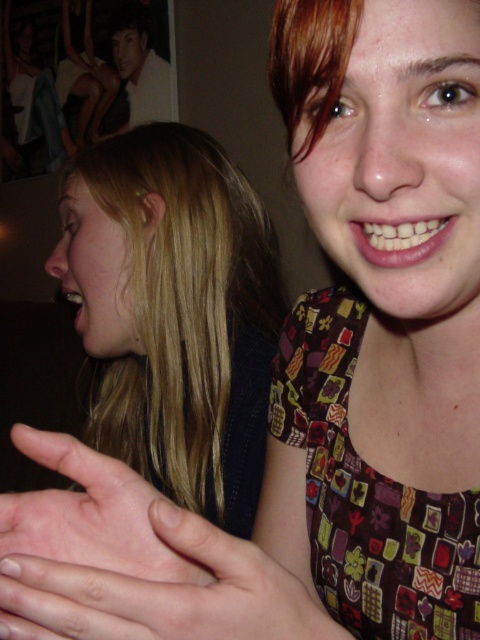
Consider the image. Which is more to the left, blondehair at left or pink flesh at center?

blondehair at left is more to the left.

What do you see at coordinates (189, 320) in the screenshot? I see `blondehair at left` at bounding box center [189, 320].

Measure the distance between blondehair at left and camera.

They are 31.07 inches apart.

Image resolution: width=480 pixels, height=640 pixels. In order to click on blondehair at left in this screenshot , I will do `click(189, 320)`.

Is point (187, 371) positioned before point (9, 563)?

No, (187, 371) is behind (9, 563).

Which of these two, blondehair at left or pink matte skin at center, stands shorter?

pink matte skin at center

Between point (112, 440) and point (227, 563), which one is positioned in front?

Point (227, 563)

Where is `blondehair at left`? blondehair at left is located at coordinates (189, 320).

Who is more distant from viewer, (336, 625) or (130, 573)?

Point (336, 625)

Does point (216, 609) come closer to viewer compared to point (147, 486)?

Yes.

Who is more forward, (80, 572) or (57, 442)?

Point (80, 572) is in front.

This screenshot has width=480, height=640. What are the coordinates of `pink matte skin at center` in the screenshot? It's located at (177, 586).